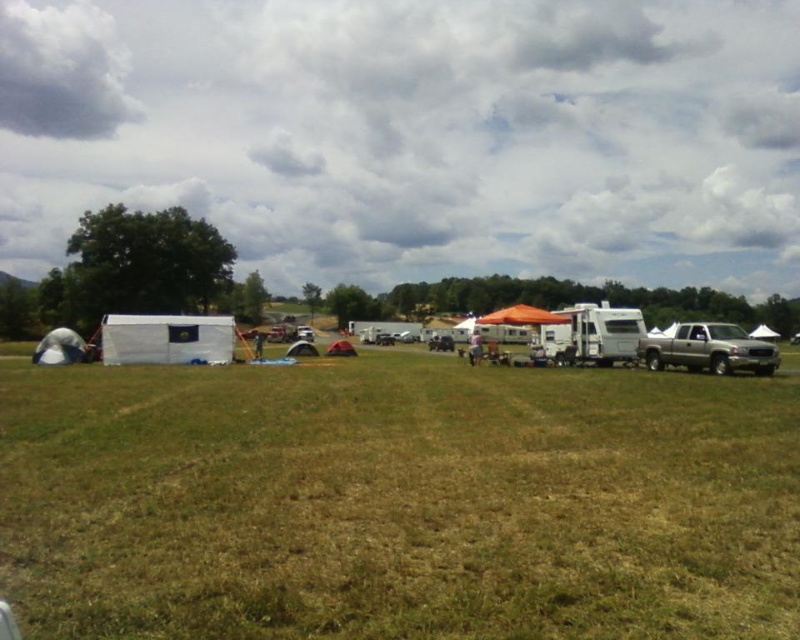
You are planning to park your car next to the silver metallic truck at right and the white fabric tent at lower left. Which one has a smaller width?

The silver metallic truck at right has a lesser width compared to the white fabric tent at lower left, so it is smaller in width.

You are standing at the center of the field and want to locate the white canvas tent at lower left. According to the coordinates provided, where would you find the point at (640,339) on the white canvas tent at lower left?

The point at (640,339) is located on the white canvas tent at lower left.